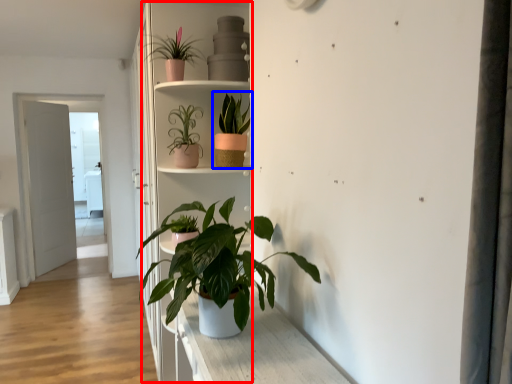
Question: Which object appears closest to the camera in this image, bookshelf (highlighted by a red box) or houseplant (highlighted by a blue box)?

Choices:
 (A) bookshelf
 (B) houseplant

Answer: (B)